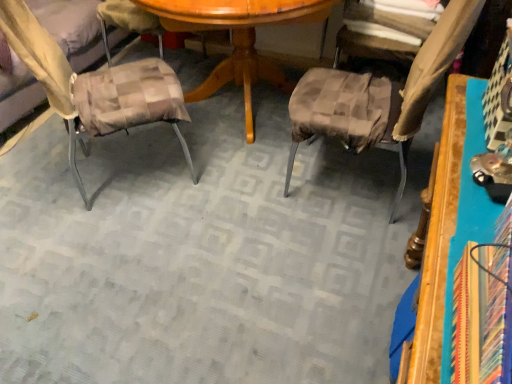
Question: Considering the relative positions of plaid fabric cushion at left, the 1th chair positioned from the left, and brown textured fabric at upper right in the image provided, is plaid fabric cushion at left, the 1th chair positioned from the left, to the right of brown textured fabric at upper right from the viewer's perspective?

Choices:
 (A) no
 (B) yes

Answer: (A)

Question: Considering the relative sizes of plaid fabric cushion at left, the second chair from the right, and brown textured fabric at upper right in the image provided, is plaid fabric cushion at left, the second chair from the right, wider than brown textured fabric at upper right?

Choices:
 (A) no
 (B) yes

Answer: (B)

Question: Is plaid fabric cushion at left, the 1th chair positioned from the left, taller than brown textured fabric at upper right?

Choices:
 (A) yes
 (B) no

Answer: (A)

Question: Is plaid fabric cushion at left, the second chair from the right, further to camera compared to brown textured fabric at upper right?

Choices:
 (A) no
 (B) yes

Answer: (A)

Question: Does plaid fabric cushion at left, the 1th chair positioned from the left, have a larger size compared to brown textured fabric at upper right?

Choices:
 (A) yes
 (B) no

Answer: (A)

Question: From a real-world perspective, relative to wooden table at right, is plaid fabric cushion at left, the second chair from the right, vertically above or below?

Choices:
 (A) below
 (B) above

Answer: (A)

Question: Visually, is plaid fabric cushion at left, the second chair from the right, positioned to the left or to the right of wooden table at right?

Choices:
 (A) right
 (B) left

Answer: (B)

Question: From their relative heights in the image, would you say plaid fabric cushion at left, the 1th chair positioned from the left, is taller or shorter than wooden table at right?

Choices:
 (A) short
 (B) tall

Answer: (A)

Question: Is point (19, 48) closer or farther from the camera than point (429, 312)?

Choices:
 (A) closer
 (B) farther

Answer: (B)

Question: Is brown checkered cushion at center, placed as the 1th chair when sorted from right to left, inside or outside of wooden table at right?

Choices:
 (A) inside
 (B) outside

Answer: (B)

Question: In the image, is brown checkered cushion at center, the second chair from the left, positioned in front of or behind wooden table at right?

Choices:
 (A) front
 (B) behind

Answer: (B)

Question: Does point (375, 79) appear closer or farther from the camera than point (476, 109)?

Choices:
 (A) farther
 (B) closer

Answer: (A)

Question: Considering the positions of brown checkered cushion at center, placed as the 1th chair when sorted from right to left, and wooden table at right in the image, is brown checkered cushion at center, placed as the 1th chair when sorted from right to left, taller or shorter than wooden table at right?

Choices:
 (A) short
 (B) tall

Answer: (B)

Question: Relative to plaid fabric cushion at left, the 1th chair positioned from the left, is brown checkered cushion at center, placed as the 1th chair when sorted from right to left, in front or behind?

Choices:
 (A) front
 (B) behind

Answer: (A)

Question: In the image, is brown checkered cushion at center, the second chair from the left, on the left side or the right side of plaid fabric cushion at left, the second chair from the right?

Choices:
 (A) right
 (B) left

Answer: (A)